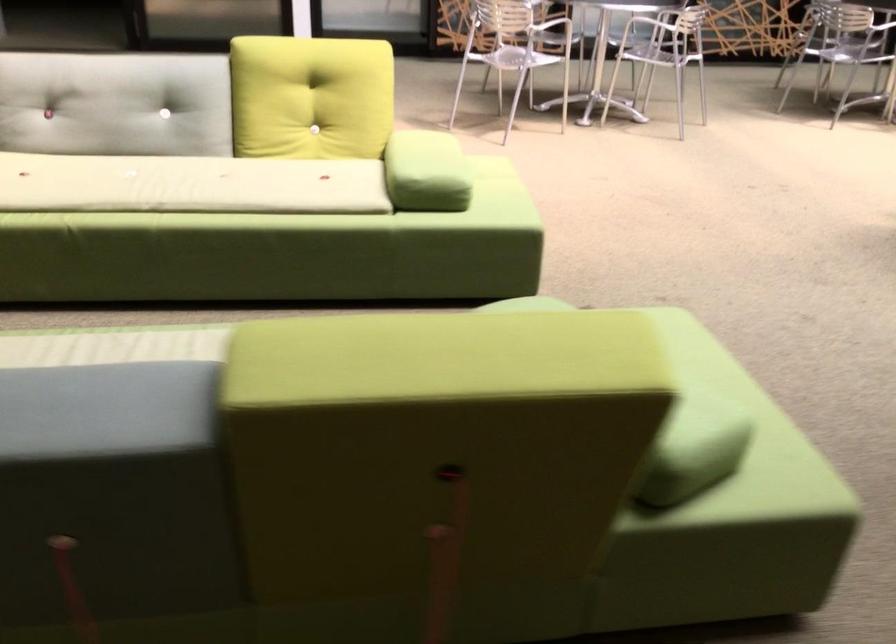
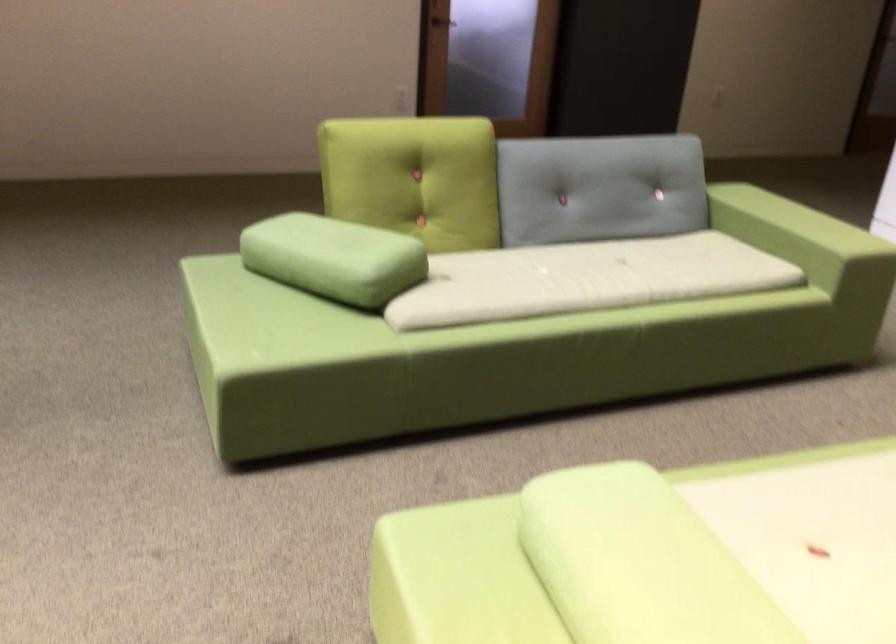
In the second image, find the point that corresponds to point 425,145 in the first image.

(651, 556)